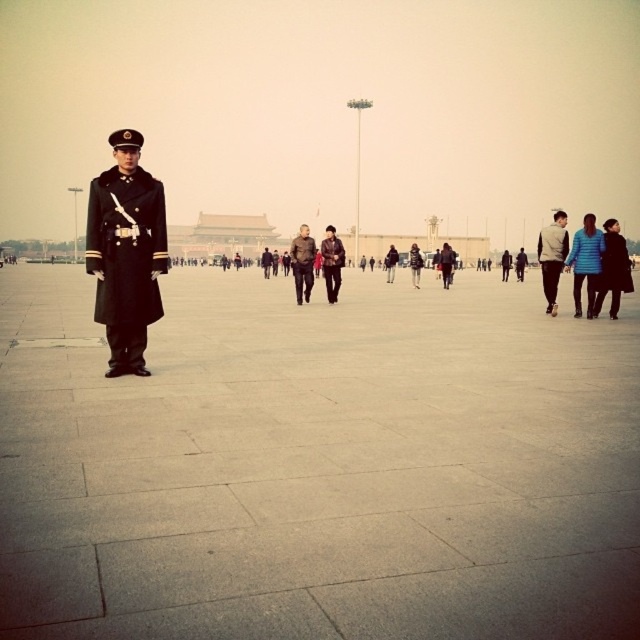
You are standing at the point labeled point (x=125, y=260) in the image. What object is located at that point?

The point (x=125, y=260) indicates the location of the black woolen coat at center.

You are standing in the plaza and want to know how far the point at coordinates [145,323] is from you. Can you determine the distance?

The point at coordinates [145,323] is 8.54 meters away from you.

You are standing in the plaza and want to place a small flag exactly halfway between point (595, 291) and point (305, 264). Will the flag be closer to the ground or the sky in the image?

The flag placed halfway between point (595, 291) and point (305, 264) will be closer to the ground because point (595, 291) is closer to the camera than point (305, 264), meaning the midpoint is closer to the ground level in the image.